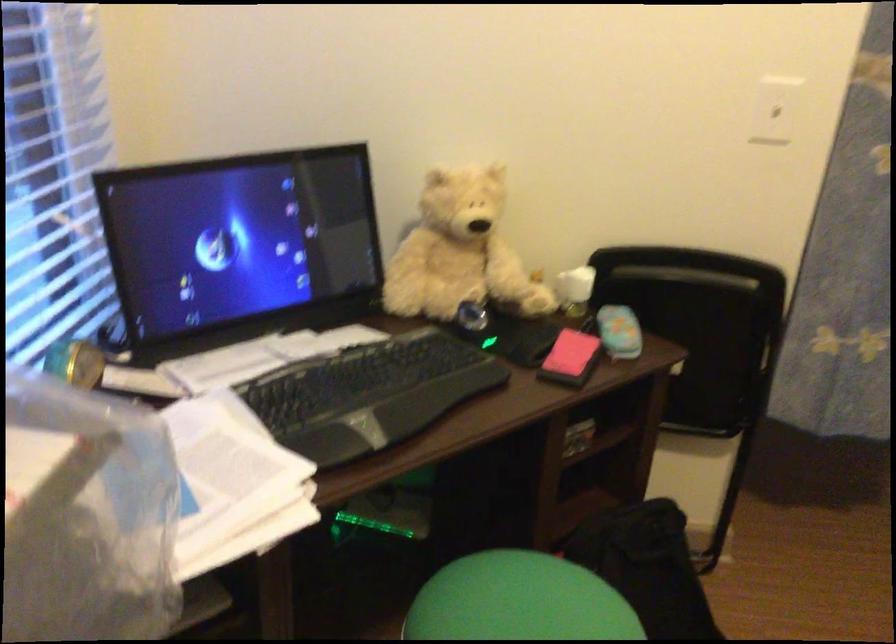
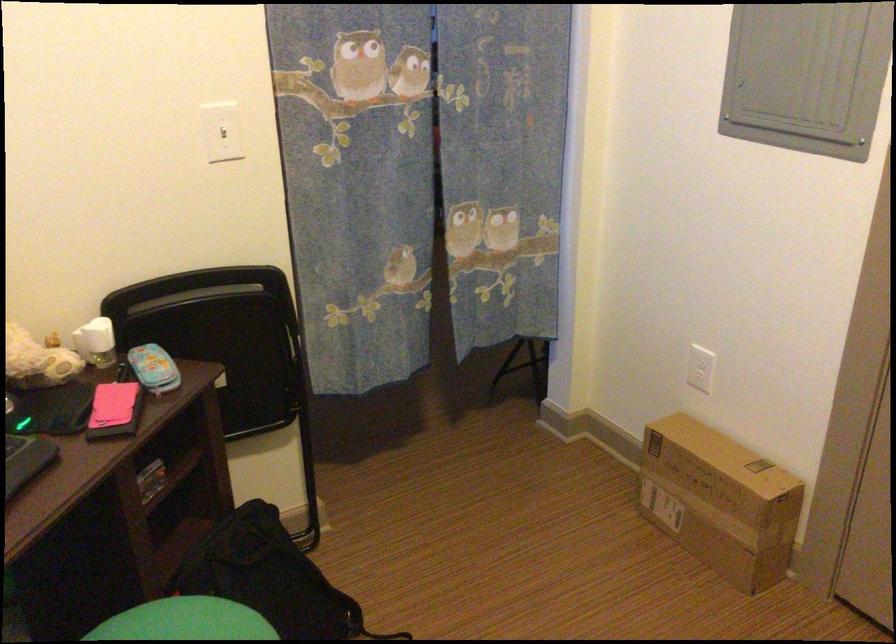
The point at (x=622, y=330) is marked in the first image. Where is the corresponding point in the second image?

(153, 368)